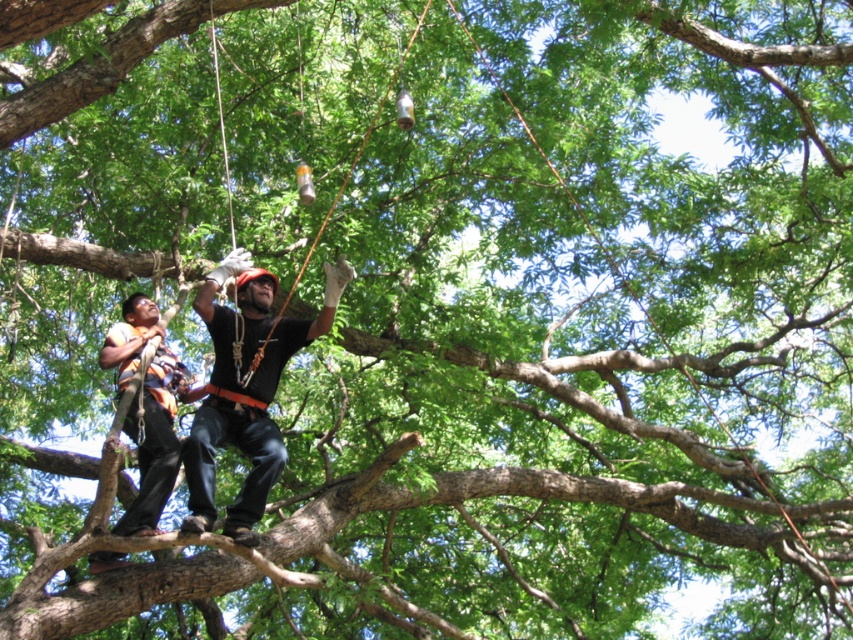
Question: Which of the following is the farthest from the observer?

Choices:
 (A) (204, 529)
 (B) (100, 365)

Answer: (B)

Question: Which of the following is the closest to the observer?

Choices:
 (A) black matte shirt at center
 (B) orange safety vest at center

Answer: (A)

Question: Is black matte shirt at center closer to camera compared to orange safety vest at center?

Choices:
 (A) no
 (B) yes

Answer: (B)

Question: Does black matte shirt at center appear over orange safety vest at center?

Choices:
 (A) yes
 (B) no

Answer: (A)

Question: Is black matte shirt at center positioned in front of orange safety vest at center?

Choices:
 (A) no
 (B) yes

Answer: (B)